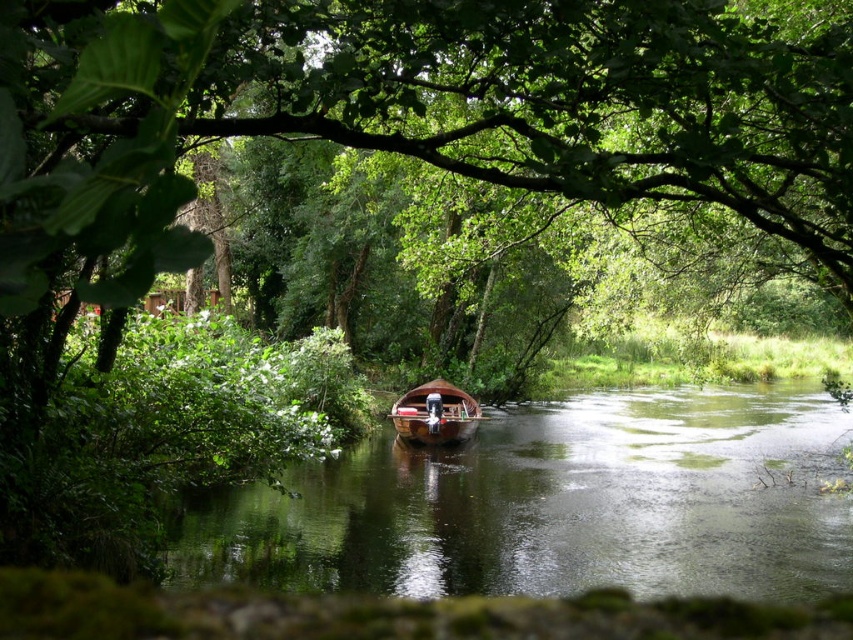
Is green leafy tree at center to the right of wooden boat at center from the viewer's perspective?

Indeed, green leafy tree at center is positioned on the right side of wooden boat at center.

What do you see at coordinates (422, 109) in the screenshot? This screenshot has height=640, width=853. I see `green leafy tree at center` at bounding box center [422, 109].

Where is `green leafy tree at center`? green leafy tree at center is located at coordinates point(422,109).

Does green leafy tree at center have a lesser height compared to brown wooden boat at center?

In fact, green leafy tree at center may be taller than brown wooden boat at center.

Is green leafy tree at center positioned in front of brown wooden boat at center?

That is True.

The height and width of the screenshot is (640, 853). Describe the element at coordinates (422, 109) in the screenshot. I see `green leafy tree at center` at that location.

The image size is (853, 640). What are the coordinates of `green leafy tree at center` in the screenshot? It's located at (422, 109).

Is brown wooden boat at center above wooden boat at center?

No, brown wooden boat at center is not above wooden boat at center.

Between brown wooden boat at center and wooden boat at center, which one has less height?

With less height is wooden boat at center.

Does point (540, 456) lie in front of point (426, 394)?

Yes, it is in front of point (426, 394).

Where is `brown wooden boat at center`? Image resolution: width=853 pixels, height=640 pixels. brown wooden boat at center is located at coordinates (550, 506).